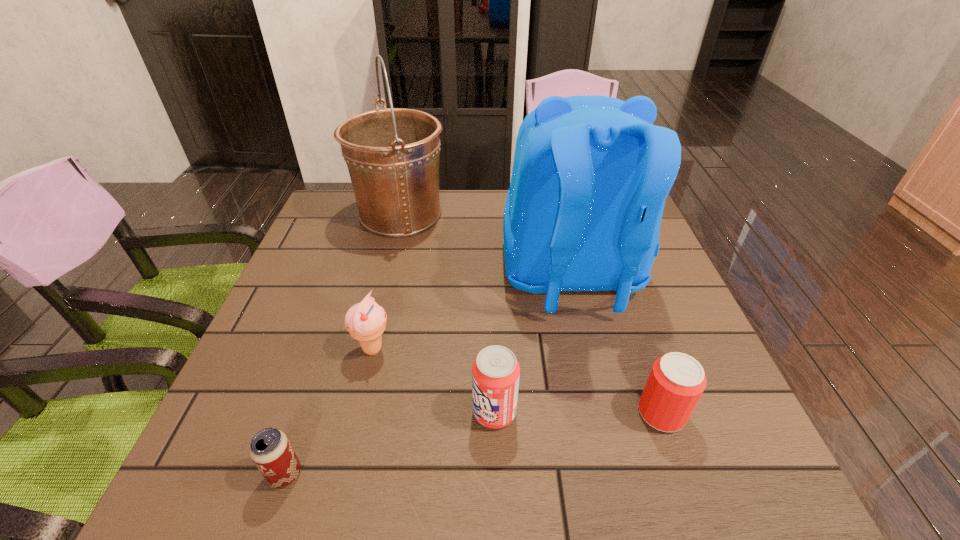
The height and width of the screenshot is (540, 960). What are the coordinates of `bucket` in the screenshot? It's located at (392, 154).

Identify the location of backpack. The width and height of the screenshot is (960, 540). (591, 173).

Find the location of a particular element. The image size is (960, 540). icecream is located at coordinates (366, 321).

I want to click on soda can, so [495, 371].

What are the coordinates of `the taller beer can` in the screenshot? It's located at (676, 382).

Locate an element on the screen. The width and height of the screenshot is (960, 540). the right beer can is located at coordinates (676, 382).

Where is `the shortest object`? The image size is (960, 540). the shortest object is located at coordinates (270, 449).

At what (x,y) coordinates should I click in order to perform the action: click on the nearest object. Please return your answer as a coordinate pair (x, y). Looking at the image, I should click on (270, 449).

You are a GUI agent. You are given a task and a screenshot of the screen. Output one action in this format:
    pyautogui.click(x=<x>, y=<y>)
    Task: Click on the vacant space situated 0.320m on the front of the bucket
    
    Given the screenshot: What is the action you would take?
    pyautogui.click(x=372, y=333)

Find the location of `vacant space situated 0.320m on the back of the backpack`. vacant space situated 0.320m on the back of the backpack is located at coordinates (620, 481).